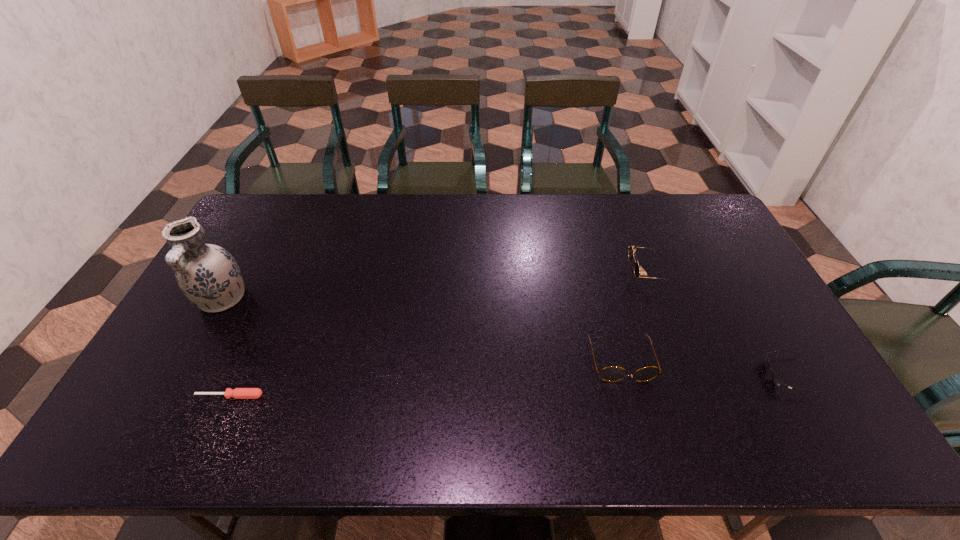
Find the location of a particular element. The width and height of the screenshot is (960, 540). the tallest object is located at coordinates (208, 275).

Find the location of a particular element. The image size is (960, 540). the farthest sunglasses is located at coordinates point(632,249).

At what (x,y) coordinates should I click in order to perform the action: click on the fourth object from left to right. Please return your answer as a coordinate pair (x, y). The height and width of the screenshot is (540, 960). Looking at the image, I should click on (632, 249).

Find the location of `the leftmost sunglasses`. the leftmost sunglasses is located at coordinates click(612, 373).

At what (x,y) coordinates should I click in order to perform the action: click on the rightmost object. Please return your answer as a coordinate pair (x, y). The image size is (960, 540). Looking at the image, I should click on (776, 380).

This screenshot has width=960, height=540. What are the coordinates of `the shortest sunglasses` in the screenshot? It's located at (776, 380).

Locate an element on the screen. The width and height of the screenshot is (960, 540). screwdriver is located at coordinates (238, 393).

Locate an element on the screen. The width and height of the screenshot is (960, 540). vacant space located with the handle on the side of the vase is located at coordinates pos(193,350).

Identify the location of vacant region located on the front lenses of the farthest sunglasses. (524, 272).

Locate an element on the screen. Image resolution: width=960 pixels, height=540 pixels. free space located on the front lenses of the farthest sunglasses is located at coordinates (512, 272).